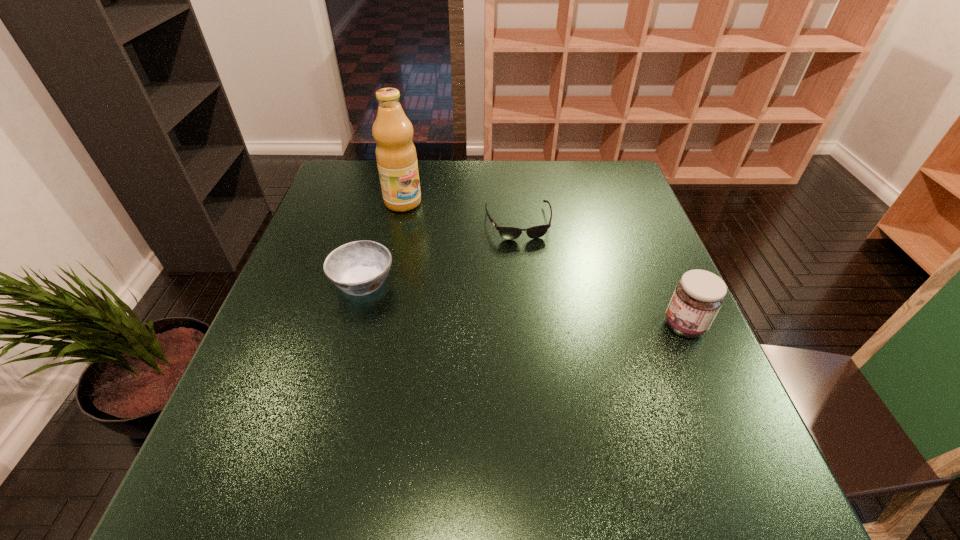
I want to click on free location at the far edge, so click(x=457, y=188).

In the image, there is a desktop. In order to click on free space at the left edge in this screenshot , I will do `click(293, 334)`.

Where is `vacant region at the right edge of the desktop`? vacant region at the right edge of the desktop is located at coordinates (633, 347).

Locate an element on the screen. This screenshot has height=540, width=960. free point at the far left corner is located at coordinates (375, 174).

I want to click on vacant space at the near left corner of the desktop, so click(x=249, y=432).

Locate an element on the screen. The image size is (960, 540). vacant area that lies between the ashtray and the olive oil is located at coordinates (383, 242).

This screenshot has width=960, height=540. I want to click on vacant space in between the olive oil and the shortest object, so click(461, 212).

You are a GUI agent. You are given a task and a screenshot of the screen. Output one action in this format:
    pyautogui.click(x=<x>, y=<y>)
    Task: Click on the free space between the nearest object and the olive oil
    This screenshot has width=960, height=540.
    Given the screenshot: What is the action you would take?
    point(543,264)

Locate an element on the screen. The width and height of the screenshot is (960, 540). free space between the shortest object and the third tallest object is located at coordinates [441, 252].

The image size is (960, 540). What are the coordinates of `free space between the ashtray and the jam` in the screenshot? It's located at (524, 304).